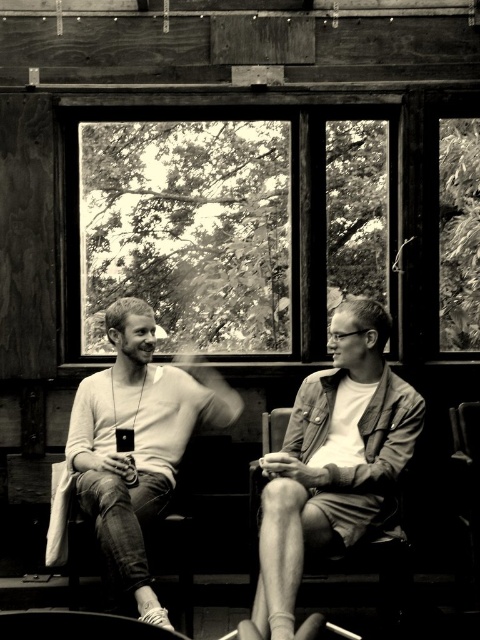
Question: Which object is farther from the camera taking this photo?

Choices:
 (A) wooden frame window at upper center
 (B) matte brown leather jacket at center
 (C) smooth white sweater at center

Answer: (A)

Question: Is wooden frame window at upper center thinner than smooth white sweater at center?

Choices:
 (A) yes
 (B) no

Answer: (B)

Question: From the image, what is the correct spatial relationship of wooden frame window at upper center in relation to smooth white sweater at center?

Choices:
 (A) left
 (B) right

Answer: (B)

Question: Which of the following is the farthest from the observer?

Choices:
 (A) (275, 486)
 (B) (165, 436)
 (C) (136, 280)

Answer: (C)

Question: Which point appears farthest from the camera in this image?

Choices:
 (A) (374, 362)
 (B) (142, 305)

Answer: (B)

Question: Does wooden frame window at upper center appear on the left side of matte brown leather jacket at center?

Choices:
 (A) no
 (B) yes

Answer: (B)